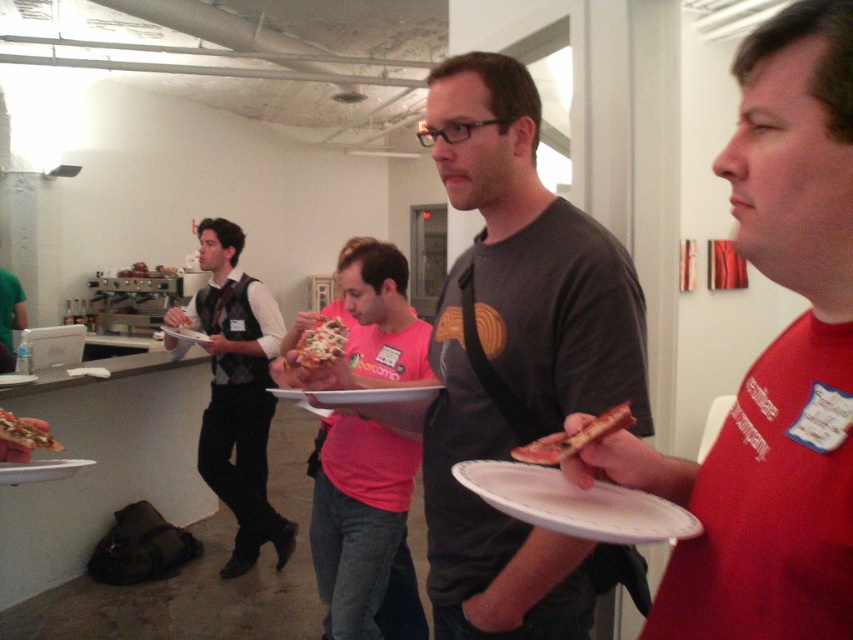
Question: Is red matte pizza slice at center closer to camera compared to white paper plate at lower right?

Choices:
 (A) yes
 (B) no

Answer: (A)

Question: Is slightly charred crust at right thinner than white matte plate at center?

Choices:
 (A) yes
 (B) no

Answer: (A)

Question: Among these points, which one is nearest to the camera?

Choices:
 (A) (514, 556)
 (B) (12, 419)

Answer: (A)

Question: Which point appears farthest from the camera in this image?

Choices:
 (A) (224, 358)
 (B) (553, 481)

Answer: (A)

Question: Which point appears farthest from the camera in this image?

Choices:
 (A) (844, 90)
 (B) (581, 493)

Answer: (B)

Question: Is white paper plate at lower right smaller than cheesy pizza slice at center?

Choices:
 (A) no
 (B) yes

Answer: (A)